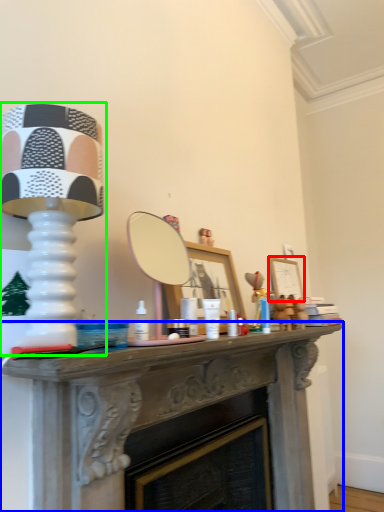
Question: Which object is positioned farthest from picture frame (highlighted by a red box)? Select from table (highlighted by a blue box) and table lamp (highlighted by a green box).

Choices:
 (A) table
 (B) table lamp

Answer: (B)